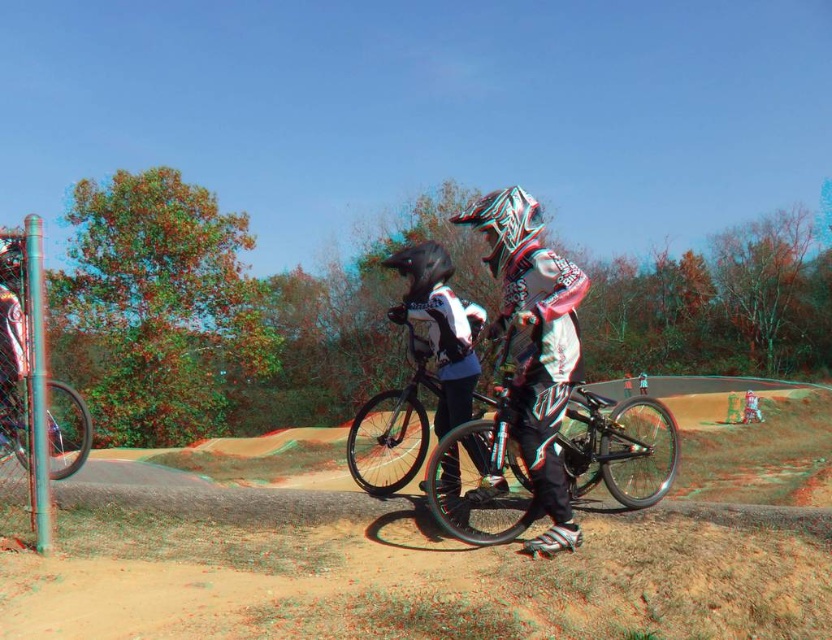
Question: Does shiny metallic helmet at center have a smaller size compared to shiny black helmet at center?

Choices:
 (A) yes
 (B) no

Answer: (A)

Question: Can you confirm if shiny black helmet at center is bigger than shiny black helmet at upper left?

Choices:
 (A) no
 (B) yes

Answer: (B)

Question: Which of the following is the closest to the observer?

Choices:
 (A) (385, 262)
 (B) (6, 276)

Answer: (B)

Question: Observing the image, what is the correct spatial positioning of shiny metallic helmet at center in reference to shiny black helmet at upper left?

Choices:
 (A) left
 (B) right

Answer: (B)

Question: Among these points, which one is nearest to the camera?

Choices:
 (A) (3, 275)
 (B) (429, 280)

Answer: (A)

Question: Which object is the closest to the shiny black helmet at center?

Choices:
 (A) shiny metallic helmet at center
 (B) shiny black helmet at upper left

Answer: (B)